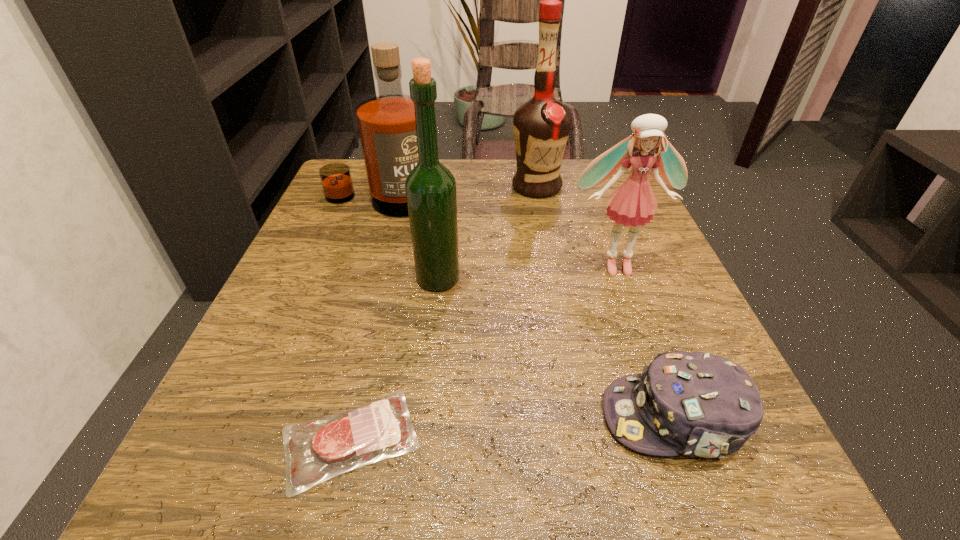
Identify the location of free space between the shortest object and the doll. (x=483, y=352).

Locate an element on the screen. This screenshot has height=540, width=960. free space between the steak and the rightmost liquor is located at coordinates (444, 313).

The width and height of the screenshot is (960, 540). Find the location of `blank region between the nearest liquor and the steak`. blank region between the nearest liquor and the steak is located at coordinates (395, 359).

You are a GUI agent. You are given a task and a screenshot of the screen. Output one action in this format:
    pyautogui.click(x=<x>, y=<y>)
    Task: Click on the vacant point located between the steak and the doll
    
    Given the screenshot: What is the action you would take?
    pyautogui.click(x=483, y=352)

Image resolution: width=960 pixels, height=540 pixels. I want to click on vacant space that's between the nearest liquor and the rightmost liquor, so (487, 233).

You are a GUI agent. You are given a task and a screenshot of the screen. Output one action in this format:
    pyautogui.click(x=<x>, y=<y>)
    Task: Click on the free area in between the nearest liquor and the steak
    
    Given the screenshot: What is the action you would take?
    pyautogui.click(x=395, y=359)

Find the location of a particular element. This screenshot has width=960, height=540. vacant region between the rightmost liquor and the steak is located at coordinates (444, 313).

This screenshot has width=960, height=540. In order to click on vacant space in between the nearest liquor and the steak in this screenshot , I will do `click(395, 359)`.

Identify which object is located as the second nearest to the nearest liquor. Please provide its 2D coordinates. Your answer should be formatted as a tuple, i.e. [(x, y)], where the tuple contains the x and y coordinates of a point satisfying the conditions above.

[(315, 451)]

The image size is (960, 540). Identify the location of object that is the second closest to the nearest liquor. (315, 451).